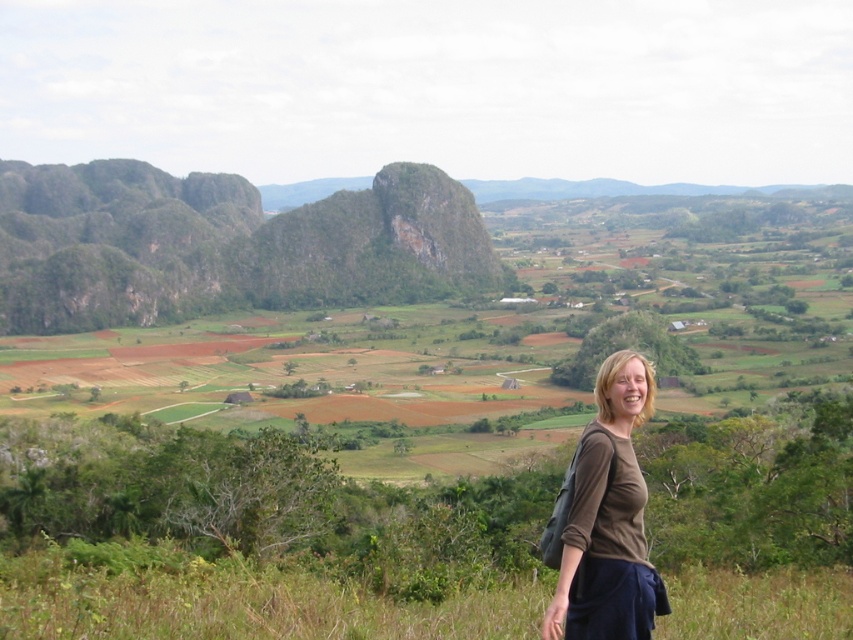
You are hiking in the scenic landscape and want to reach the point marked as point (624, 484). You are currently at point (451, 180). Which direction should you move to get closer to your destination?

To reach point (624, 484) from point (451, 180), you should move away from the viewer since point (451, 180) is closer to the viewer than point (624, 484).

You are a hiker standing at the point marked by the coordinates point (224, 244). You want to reach the nearest farmhouse in the valley. Which direction should you head towards?

The point (224, 244) marks the green rock formation at upper left. To reach the nearest farmhouse in the valley, you should head towards the midground valley where the small clusters of buildings are located, which is southward from the green rock formation at upper left.